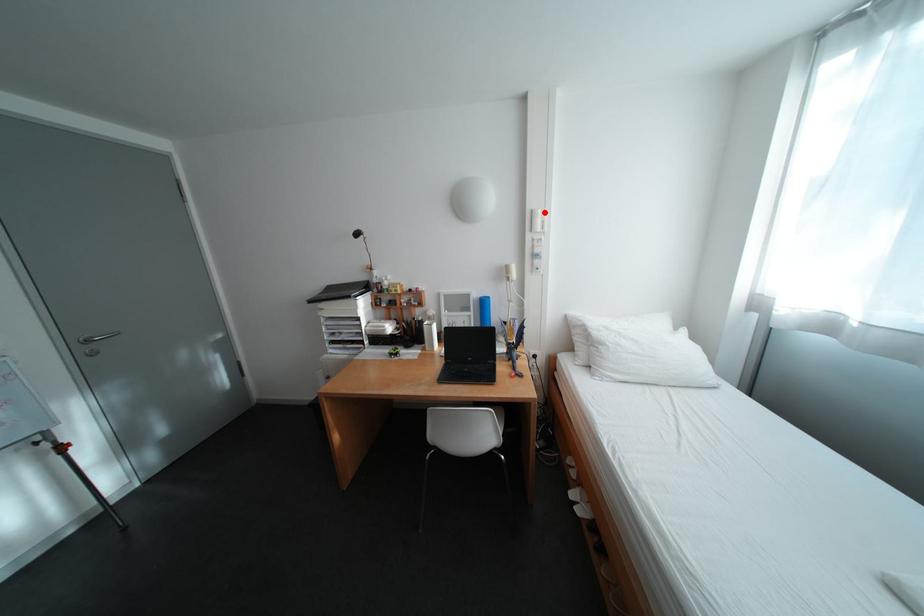
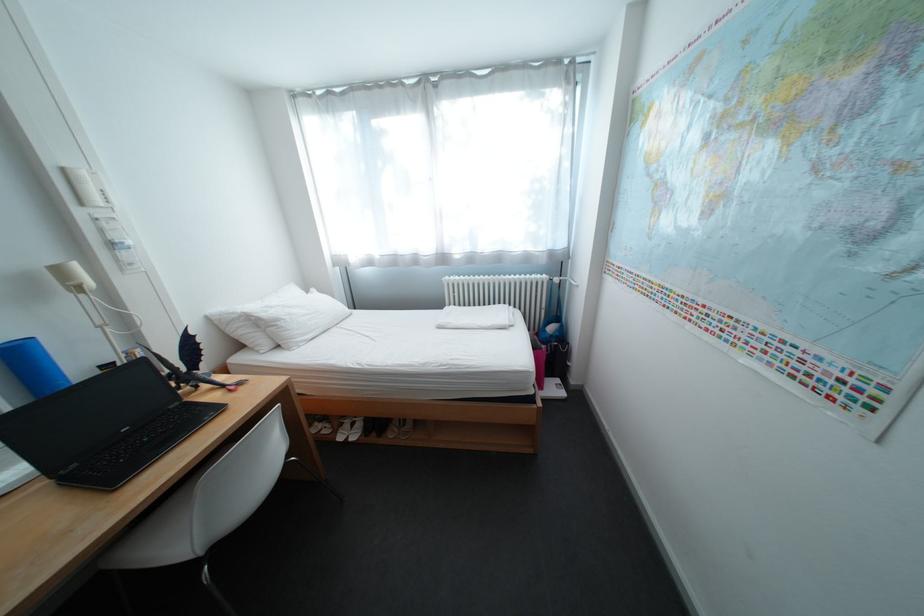
In the second image, find the point that corresponds to the highlighted location in the first image.

(76, 171)